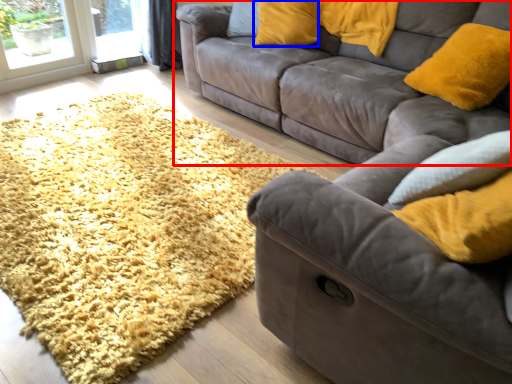
Question: Among these objects, which one is nearest to the camera, studio couch (highlighted by a red box) or pillow (highlighted by a blue box)?

Choices:
 (A) studio couch
 (B) pillow

Answer: (A)